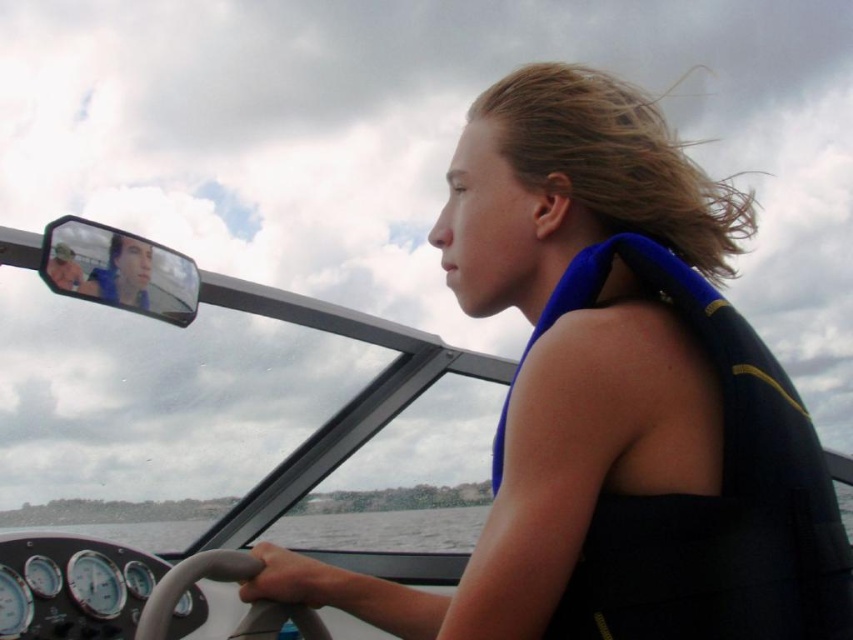
Question: Which point is farther to the camera?

Choices:
 (A) blue fabric life jacket at center
 (B) blue neoprene life vest at center

Answer: (B)

Question: Can you confirm if blue neoprene life vest at center is positioned below blue fabric life jacket at center?

Choices:
 (A) yes
 (B) no

Answer: (B)

Question: Which of the following is the closest to the observer?

Choices:
 (A) (683, 600)
 (B) (553, 323)

Answer: (A)

Question: Can you confirm if blue neoprene life vest at center is positioned to the right of blue fabric life jacket at center?

Choices:
 (A) no
 (B) yes

Answer: (A)

Question: Is blue neoprene life vest at center closer to camera compared to blue fabric life jacket at center?

Choices:
 (A) no
 (B) yes

Answer: (A)